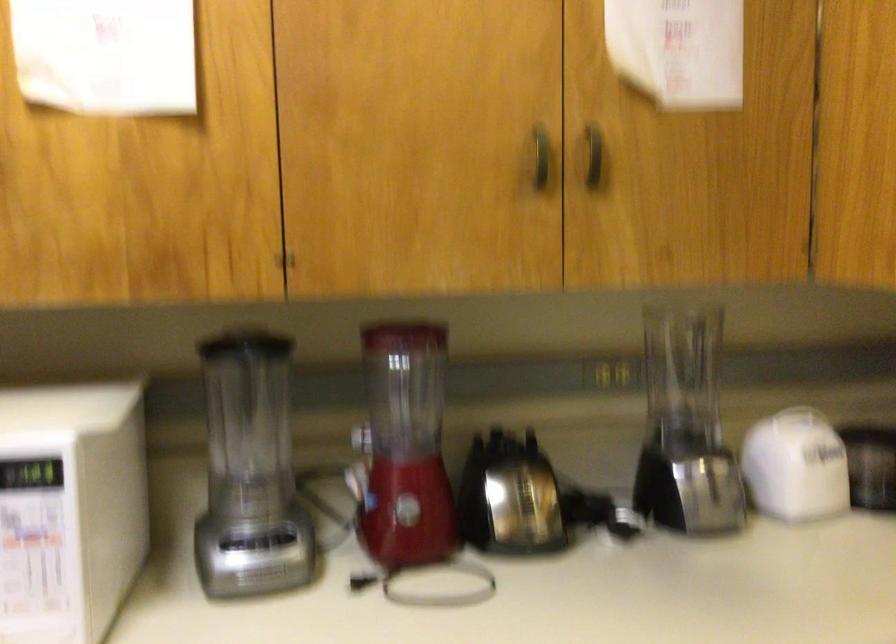
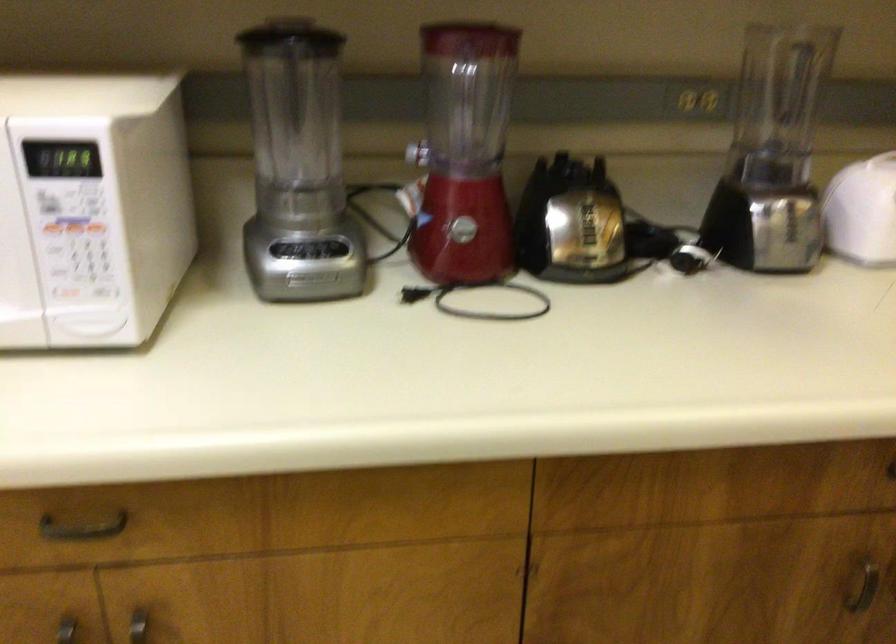
Question: Based on the continuous images, in which direction is the camera rotating? Reply with the corresponding letter.

Choices:
 (A) Left
 (B) Right
 (C) Up
 (D) Down

Answer: (D)